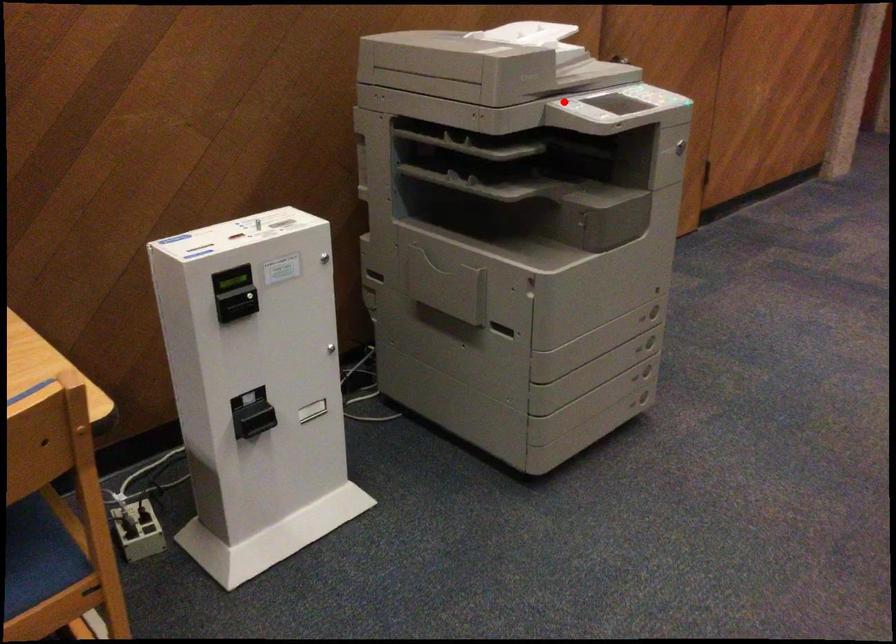
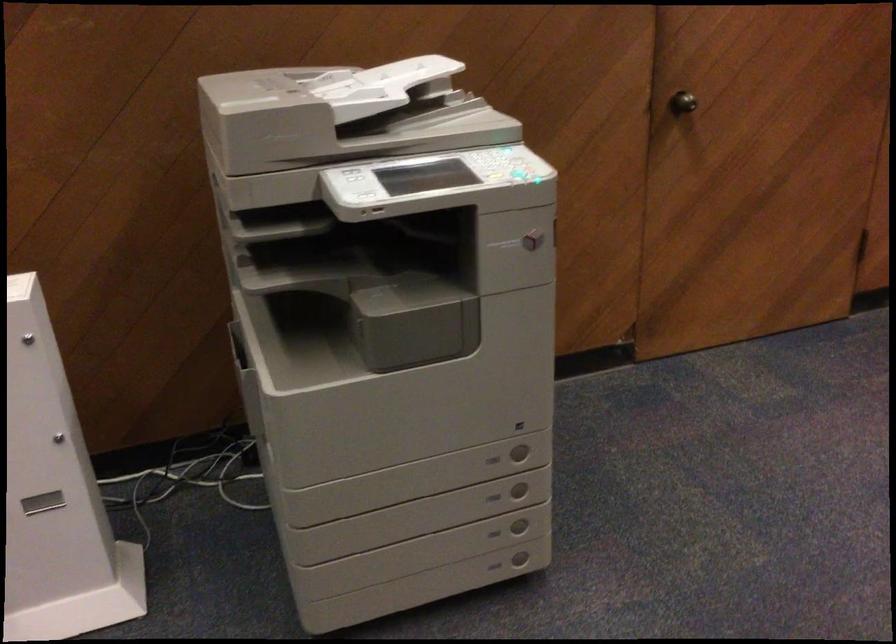
Question: I am providing you with two images of the same scene from different viewpoints. A red point is marked on the first image. Is the red point's position out of view in image 2?

Choices:
 (A) Yes
 (B) No

Answer: (B)